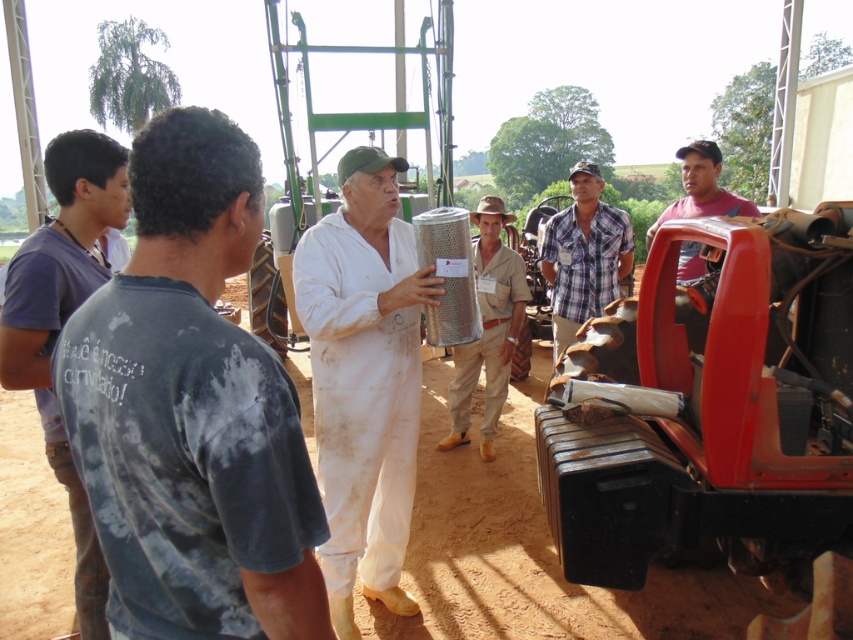
Question: Can you confirm if dark gray tie-dye t-shirt at left is positioned to the right of metallic mesh filter at center?

Choices:
 (A) yes
 (B) no

Answer: (B)

Question: Is dark gray tie-dye t-shirt at left below plaid fabric shirt at center?

Choices:
 (A) yes
 (B) no

Answer: (A)

Question: Which object is positioned closest to the matte red truck door at right?

Choices:
 (A) plaid fabric shirt at center
 (B) white matte jumpsuit at center
 (C) dark blue shirt at left
 (D) metallic mesh filter at center

Answer: (A)

Question: Which object is closer to the camera taking this photo?

Choices:
 (A) dark blue shirt at left
 (B) metallic mesh filter at center

Answer: (A)

Question: Among these points, which one is nearest to the camera?

Choices:
 (A) (556, 243)
 (B) (160, 179)
 (C) (35, 328)
 (D) (514, 214)

Answer: (B)

Question: Can you confirm if dark blue shirt at left is positioned to the right of metallic mesh filter at center?

Choices:
 (A) no
 (B) yes

Answer: (A)